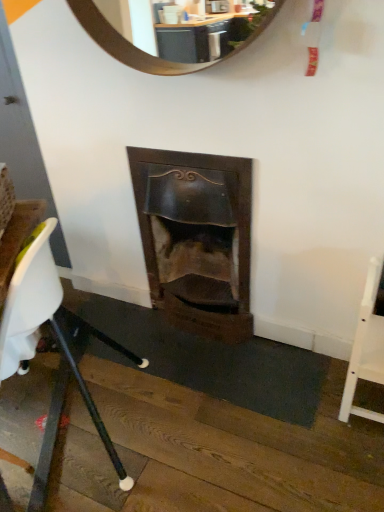
In order to click on unoccupied space behind white wood chair at right, the first chair viewed from the right in this screenshot , I will do `click(318, 360)`.